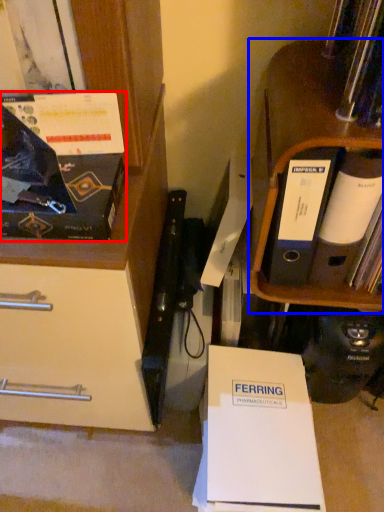
Question: Which object appears farthest to the camera in this image, magazine (highlighted by a red box) or shelf (highlighted by a blue box)?

Choices:
 (A) magazine
 (B) shelf

Answer: (B)